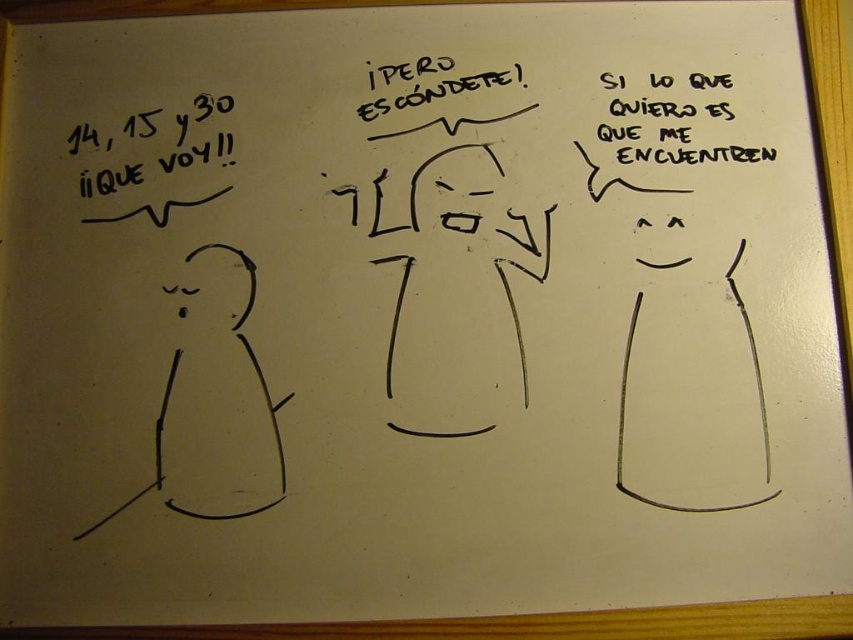
Can you confirm if black paper text at upper right is taller than black marker text at center?

Yes.

Can you confirm if black paper text at upper right is positioned to the right of black marker text at center?

Yes, black paper text at upper right is to the right of black marker text at center.

Which is in front, point (677, 108) or point (393, 106)?

Point (393, 106) is more forward.

I want to click on black paper text at upper right, so click(x=695, y=154).